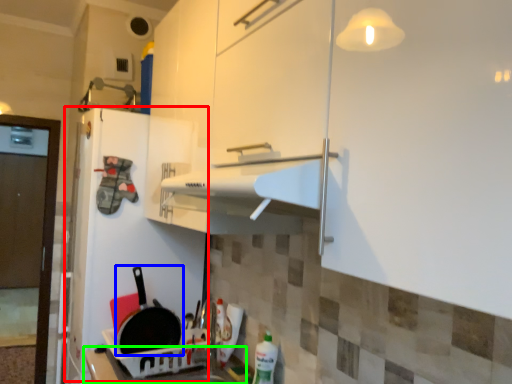
Question: Which object is the farthest from fridge (highlighted by a red box)? Choose among these: frying pan (highlighted by a blue box) or counter top (highlighted by a green box).

Choices:
 (A) frying pan
 (B) counter top

Answer: (B)